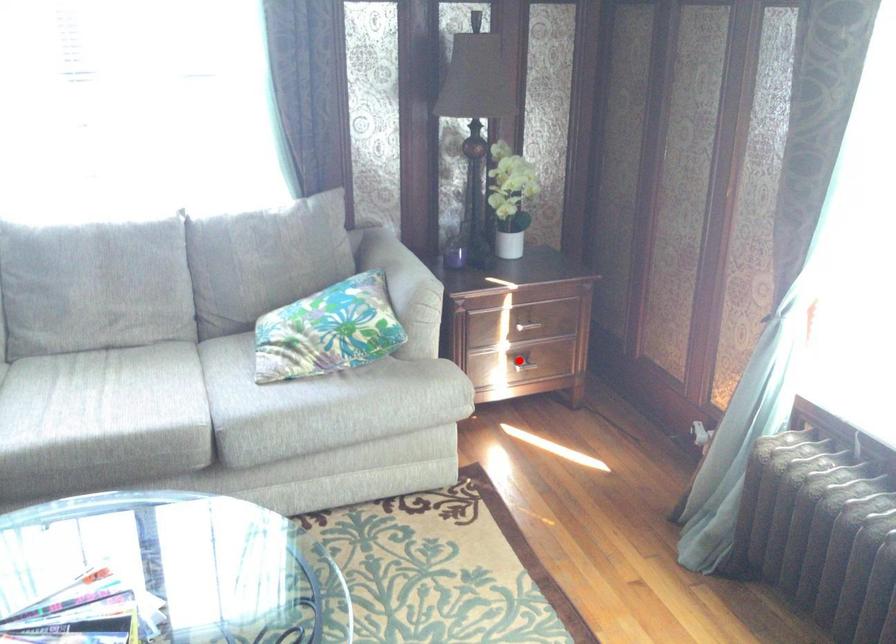
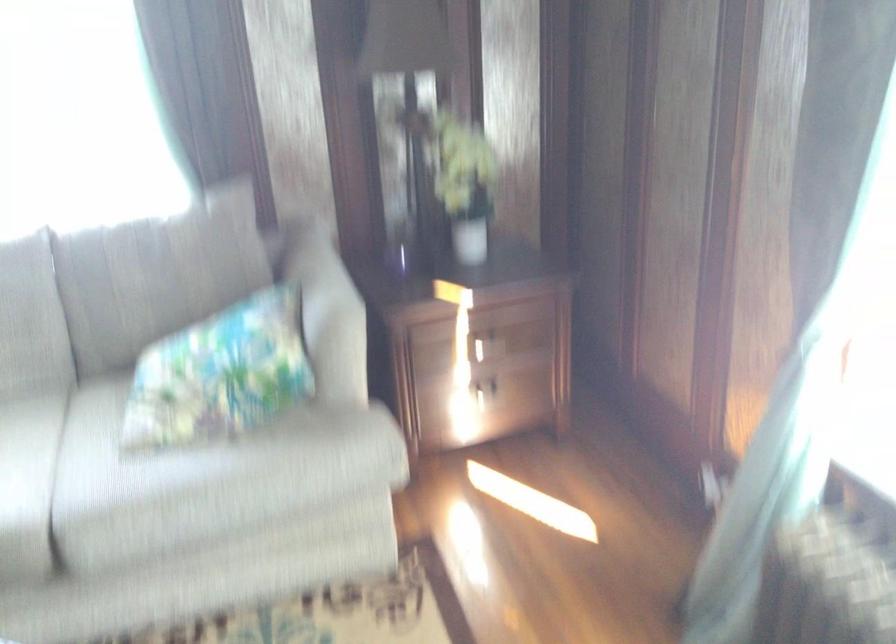
Question: I am providing you with two images of the same scene from different viewpoints. In image1, a red point is highlighted. Considering the same 3D point in image2, which of the following is correct?

Choices:
 (A) It is closer
 (B) It is farther

Answer: (A)